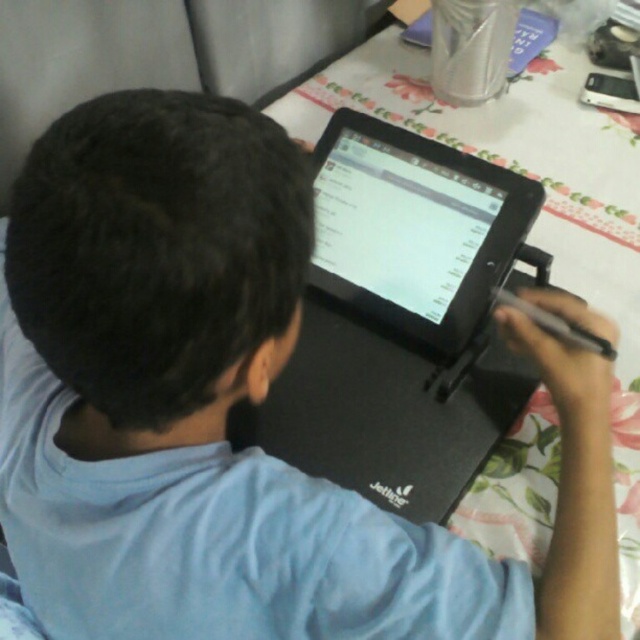
Question: Is black matte laptop at center wider than black glossy tablet at center?

Choices:
 (A) yes
 (B) no

Answer: (A)

Question: Which point appears farthest from the camera in this image?

Choices:
 (A) (433, 298)
 (B) (476, 214)

Answer: (A)

Question: Is black matte laptop at center below black glossy tablet at center?

Choices:
 (A) no
 (B) yes

Answer: (B)

Question: Which point is farther to the camera?

Choices:
 (A) (460, 260)
 (B) (308, 278)

Answer: (B)

Question: Is black matte laptop at center bigger than black glossy tablet at center?

Choices:
 (A) no
 (B) yes

Answer: (B)